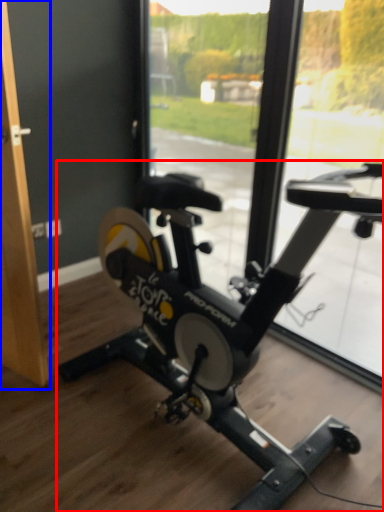
Question: Which object appears farthest to the camera in this image, stationary bicycle (highlighted by a red box) or screen door (highlighted by a blue box)?

Choices:
 (A) stationary bicycle
 (B) screen door

Answer: (B)